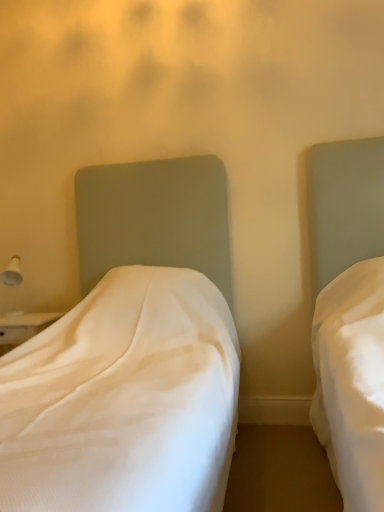
The height and width of the screenshot is (512, 384). I want to click on white glossy lampshade at left, so click(12, 273).

At what (x,y) coordinates should I click in order to perform the action: click on white fabric bed at left, the 1th bed positioned from the left. Please return your answer as a coordinate pair (x, y). The width and height of the screenshot is (384, 512). Looking at the image, I should click on (130, 357).

Is white glossy lampshade at left located within matte white bed at right, acting as the first bed starting from the right?

Definitely not — white glossy lampshade at left is not inside matte white bed at right, acting as the first bed starting from the right.

Looking at their sizes, would you say matte white bed at right, acting as the first bed starting from the right, is wider or thinner than white glossy lampshade at left?

Clearly, matte white bed at right, acting as the first bed starting from the right, has more width compared to white glossy lampshade at left.

Is matte white bed at right, acting as the first bed starting from the right, bigger or smaller than white glossy lampshade at left?

matte white bed at right, acting as the first bed starting from the right, is bigger than white glossy lampshade at left.

From a real-world perspective, is matte white bed at right, placed as the second bed when sorted from left to right, under white glossy lampshade at left?

Indeed, from a real-world perspective, matte white bed at right, placed as the second bed when sorted from left to right, is positioned beneath white glossy lampshade at left.

Is white fabric bed at left, which appears as the second bed when viewed from the right, in front of white glossy lampshade at left?

Yes, white fabric bed at left, which appears as the second bed when viewed from the right, is closer to the camera.

From the picture: Could you tell me if white fabric bed at left, the 1th bed positioned from the left, is facing white glossy lampshade at left?

No, white fabric bed at left, the 1th bed positioned from the left, is not turned towards white glossy lampshade at left.

Is point (39, 490) closer or farther from the camera than point (23, 312)?

Point (39, 490).

Considering the sizes of objects white fabric bed at left, the 1th bed positioned from the left, and white glossy lampshade at left in the image provided, who is shorter, white fabric bed at left, the 1th bed positioned from the left, or white glossy lampshade at left?

Standing shorter between the two is white glossy lampshade at left.

Locate an element on the screen. The image size is (384, 512). bed located in front of the white fabric bed at left, which appears as the second bed when viewed from the right is located at coordinates (349, 314).

How different are the orientations of matte white bed at right, acting as the first bed starting from the right, and white fabric bed at left, which appears as the second bed when viewed from the right, in degrees?

There is a 1.12e-05-degree angle between the facing directions of matte white bed at right, acting as the first bed starting from the right, and white fabric bed at left, which appears as the second bed when viewed from the right.

Which object is positioned more to the left, matte white bed at right, placed as the second bed when sorted from left to right, or white fabric bed at left, the 1th bed positioned from the left?

Positioned to the left is white fabric bed at left, the 1th bed positioned from the left.

Is point (144, 460) farther from camera compared to point (342, 201)?

No, (144, 460) is in front of (342, 201).

Considering the sizes of objects white fabric bed at left, which appears as the second bed when viewed from the right, and matte white bed at right, acting as the first bed starting from the right, in the image provided, who is taller, white fabric bed at left, which appears as the second bed when viewed from the right, or matte white bed at right, acting as the first bed starting from the right,?

white fabric bed at left, which appears as the second bed when viewed from the right.

Is white fabric bed at left, which appears as the second bed when viewed from the right, not close to matte white bed at right, placed as the second bed when sorted from left to right?

No.

Could you tell me if white fabric bed at left, which appears as the second bed when viewed from the right, is turned towards matte white bed at right, placed as the second bed when sorted from left to right?

No, white fabric bed at left, which appears as the second bed when viewed from the right, is not aimed at matte white bed at right, placed as the second bed when sorted from left to right.

Is white glossy lampshade at left aimed at white fabric bed at left, which appears as the second bed when viewed from the right?

No, white glossy lampshade at left does not turn towards white fabric bed at left, which appears as the second bed when viewed from the right.

From the image's perspective, which one is positioned lower, white glossy lampshade at left or white fabric bed at left, the 1th bed positioned from the left?

white fabric bed at left, the 1th bed positioned from the left, is shown below in the image.

In the scene shown: From a real-world perspective, is white glossy lampshade at left above or below white fabric bed at left, the 1th bed positioned from the left?

white glossy lampshade at left is situated higher than white fabric bed at left, the 1th bed positioned from the left, in the real world.

How distant is white glossy lampshade at left from matte white bed at right, placed as the second bed when sorted from left to right?

Answer: white glossy lampshade at left and matte white bed at right, placed as the second bed when sorted from left to right, are 6.22 feet apart.

Considering the sizes of objects white glossy lampshade at left and matte white bed at right, acting as the first bed starting from the right, in the image provided, who is bigger, white glossy lampshade at left or matte white bed at right, acting as the first bed starting from the right,?

matte white bed at right, acting as the first bed starting from the right.

Does white glossy lampshade at left have a lesser height compared to matte white bed at right, placed as the second bed when sorted from left to right?

Correct, white glossy lampshade at left is not as tall as matte white bed at right, placed as the second bed when sorted from left to right.

Is white glossy lampshade at left thinner than matte white bed at right, acting as the first bed starting from the right?

Indeed, white glossy lampshade at left has a lesser width compared to matte white bed at right, acting as the first bed starting from the right.

From the white glossy lampshade at left, count 2nd bed to the right and point to it. Please provide its 2D coordinates.

[(349, 314)]

From a real-world perspective, which bed is the 2nd one underneath the white glossy lampshade at left? Please provide its 2D coordinates.

[(130, 357)]

Which object lies further to the anchor point white fabric bed at left, which appears as the second bed when viewed from the right, white glossy lampshade at left or matte white bed at right, placed as the second bed when sorted from left to right?

white glossy lampshade at left.

From the image, which object appears to be nearer to white glossy lampshade at left, white fabric bed at left, which appears as the second bed when viewed from the right, or matte white bed at right, placed as the second bed when sorted from left to right?

white fabric bed at left, which appears as the second bed when viewed from the right, lies closer to white glossy lampshade at left than the other object.

Consider the image. When comparing their distances from white fabric bed at left, which appears as the second bed when viewed from the right, does matte white bed at right, placed as the second bed when sorted from left to right, or white glossy lampshade at left seem further?

Among the two, white glossy lampshade at left is located further to white fabric bed at left, which appears as the second bed when viewed from the right.

In the scene shown: Considering their positions, is matte white bed at right, placed as the second bed when sorted from left to right, positioned further to white glossy lampshade at left than white fabric bed at left, the 1th bed positioned from the left?

Among the two, matte white bed at right, placed as the second bed when sorted from left to right, is located further to white glossy lampshade at left.

From the image, which object appears to be farther from matte white bed at right, acting as the first bed starting from the right, white glossy lampshade at left or white fabric bed at left, which appears as the second bed when viewed from the right?

white glossy lampshade at left is further to matte white bed at right, acting as the first bed starting from the right.

Considering their positions, is white fabric bed at left, which appears as the second bed when viewed from the right, positioned closer to matte white bed at right, acting as the first bed starting from the right, than white glossy lampshade at left?

Based on the image, white fabric bed at left, which appears as the second bed when viewed from the right, appears to be nearer to matte white bed at right, acting as the first bed starting from the right.

Where is `bed positioned between matte white bed at right, acting as the first bed starting from the right, and white glossy lampshade at left from near to far`? Image resolution: width=384 pixels, height=512 pixels. bed positioned between matte white bed at right, acting as the first bed starting from the right, and white glossy lampshade at left from near to far is located at coordinates (130, 357).